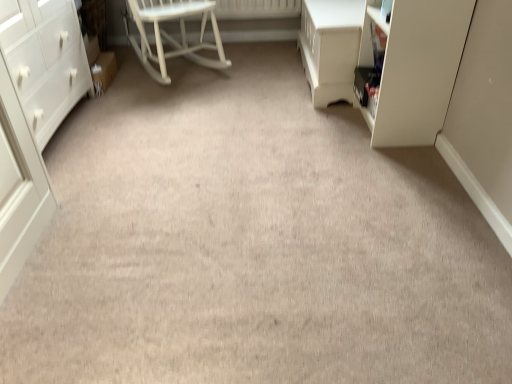
Question: Considering the relative positions of white wood rocking chair at center and white matte chest of drawers at left in the image provided, is white wood rocking chair at center to the left of white matte chest of drawers at left from the viewer's perspective?

Choices:
 (A) no
 (B) yes

Answer: (A)

Question: From the image's perspective, does white wood rocking chair at center appear higher than white matte chest of drawers at left?

Choices:
 (A) yes
 (B) no

Answer: (A)

Question: From a real-world perspective, is white wood rocking chair at center over white matte chest of drawers at left?

Choices:
 (A) no
 (B) yes

Answer: (A)

Question: Is white matte chest of drawers at left a part of white wood rocking chair at center?

Choices:
 (A) no
 (B) yes

Answer: (A)

Question: From the image's perspective, is white wood rocking chair at center below white matte chest of drawers at left?

Choices:
 (A) yes
 (B) no

Answer: (B)

Question: From a real-world perspective, is white wood rocking chair at center physically below white matte chest of drawers at left?

Choices:
 (A) no
 (B) yes

Answer: (B)

Question: Considering the relative sizes of white matte chest of drawers at left and white wood rocking chair at center in the image provided, is white matte chest of drawers at left bigger than white wood rocking chair at center?

Choices:
 (A) yes
 (B) no

Answer: (A)

Question: Considering the relative positions of white matte chest of drawers at left and white wood rocking chair at center in the image provided, is white matte chest of drawers at left to the left of white wood rocking chair at center from the viewer's perspective?

Choices:
 (A) yes
 (B) no

Answer: (A)

Question: Does white matte chest of drawers at left have a lesser width compared to white wood rocking chair at center?

Choices:
 (A) no
 (B) yes

Answer: (B)

Question: From the image's perspective, is white matte chest of drawers at left beneath white wood rocking chair at center?

Choices:
 (A) yes
 (B) no

Answer: (A)

Question: Is white matte chest of drawers at left in contact with white wood rocking chair at center?

Choices:
 (A) no
 (B) yes

Answer: (A)

Question: From a real-world perspective, is white matte chest of drawers at left over white wood rocking chair at center?

Choices:
 (A) no
 (B) yes

Answer: (B)

Question: Does white glossy vanity at upper right have a lesser height compared to white matte chest of drawers at left?

Choices:
 (A) no
 (B) yes

Answer: (B)